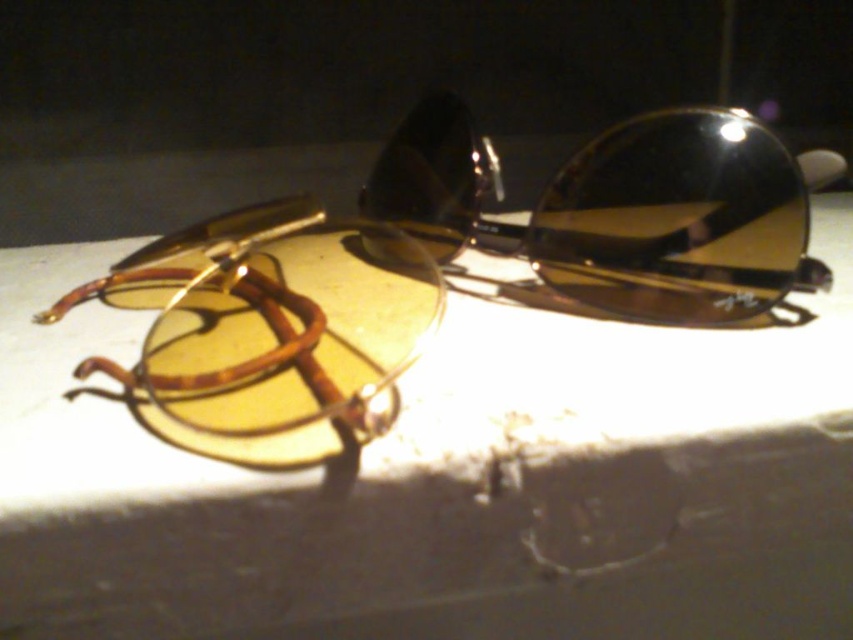
Describe the element at coordinates (447, 481) in the screenshot. Image resolution: width=853 pixels, height=640 pixels. I see `matte yellow sunglasses at center` at that location.

Looking at this image, does matte yellow sunglasses at center have a lesser width compared to shiny black sunglasses at center?

No, matte yellow sunglasses at center is not thinner than shiny black sunglasses at center.

At what (x,y) coordinates should I click in order to perform the action: click on matte yellow sunglasses at center. Please return your answer as a coordinate pair (x, y). Image resolution: width=853 pixels, height=640 pixels. Looking at the image, I should click on (447, 481).

Where is `matte yellow sunglasses at center`? The width and height of the screenshot is (853, 640). matte yellow sunglasses at center is located at coordinates (447, 481).

Who is shorter, matte yellow sunglasses at center or matte brown goggles at left?

matte brown goggles at left is shorter.

Can you confirm if matte yellow sunglasses at center is positioned above matte brown goggles at left?

No, matte yellow sunglasses at center is not above matte brown goggles at left.

Where is `matte yellow sunglasses at center`? The image size is (853, 640). matte yellow sunglasses at center is located at coordinates (447, 481).

Can you confirm if shiny black sunglasses at center is positioned below matte brown goggles at left?

Incorrect, shiny black sunglasses at center is not positioned below matte brown goggles at left.

Is shiny black sunglasses at center thinner than matte brown goggles at left?

No, shiny black sunglasses at center is not thinner than matte brown goggles at left.

At what (x,y) coordinates should I click in order to perform the action: click on shiny black sunglasses at center. Please return your answer as a coordinate pair (x, y). Looking at the image, I should click on (618, 211).